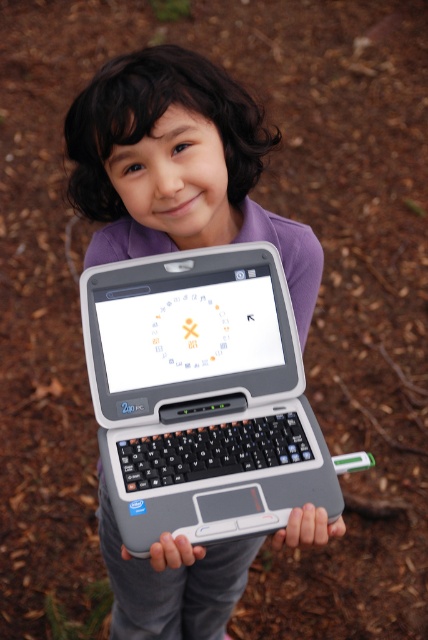
You are a child holding two laptops, the gray plastic laptop at center and the gray matte laptop at center. You want to place them side by side on a shelf that is 18 inches wide. Can both laptops fit on the shelf if placed next to each other?

The gray plastic laptop at center is 9.27 inches away from gray matte laptop at center. Since the total distance between them is 9.27 inches, which is less than the 18 inch shelf width, both laptops can fit on the shelf when placed side by side.

You are a teacher preparing a classroom activity and need to choose between two laptops for a young student. The gray plastic laptop at center and the matte gray laptop at center are available. Based on their sizes, which one is more suitable for a child to hold comfortably?

The matte gray laptop at center is smaller in size than the gray plastic laptop at center, making it more suitable for a child to hold comfortably.

You are a photographer trying to capture the child holding both laptops. Since the child is holding two laptops, one gray plastic laptop at center and one gray matte laptop at center, which one is blocking the view of the other?

The gray plastic laptop at center is positioned over the gray matte laptop at center, so it is blocking the view of the gray matte laptop at center.